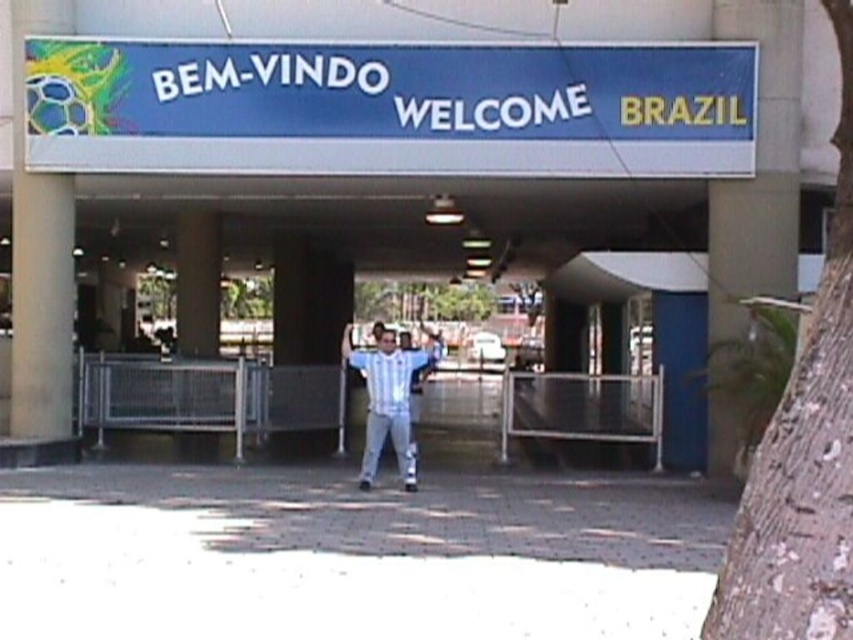
Question: Which is nearer to the white fabric shirt at center?

Choices:
 (A) blue glossy sign at upper center
 (B) smooth concrete pillar at upper left
 (C) gray concrete pillar at upper right

Answer: (A)

Question: Among these points, which one is farthest from the camera?

Choices:
 (A) (396, 412)
 (B) (712, 216)
 (C) (518, 236)

Answer: (C)

Question: Among these points, which one is nearest to the camera?

Choices:
 (A) (352, 256)
 (B) (32, 244)

Answer: (B)

Question: Is gray concrete pillar at upper right above white fabric shirt at center?

Choices:
 (A) no
 (B) yes

Answer: (B)

Question: Where is gray concrete pillar at upper right located in relation to smooth concrete pillar at upper left in the image?

Choices:
 (A) above
 (B) below

Answer: (B)

Question: Is gray concrete pillar at upper right to the right of smooth concrete pillar at upper left from the viewer's perspective?

Choices:
 (A) yes
 (B) no

Answer: (A)